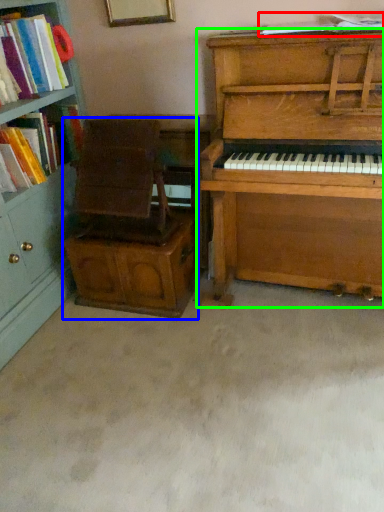
Question: Based on their relative distances, which object is nearer to book (highlighted by a red box)? Choose from armchair (highlighted by a blue box) and piano (highlighted by a green box).

Choices:
 (A) armchair
 (B) piano

Answer: (B)